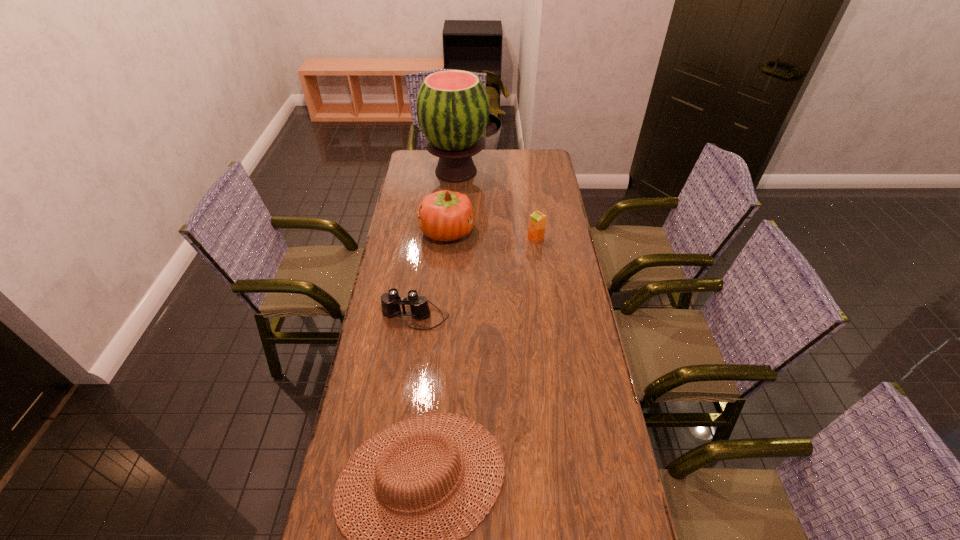
Where is `watermelon present at the left edge`? This screenshot has width=960, height=540. watermelon present at the left edge is located at coordinates point(452,106).

The image size is (960, 540). Find the location of `pumpkin at the left edge`. pumpkin at the left edge is located at coordinates (444, 215).

I want to click on binoculars present at the left edge, so click(390, 302).

Locate an element on the screen. This screenshot has width=960, height=540. object located in the right edge section of the desktop is located at coordinates (537, 223).

In order to click on object that is at the far left corner in this screenshot , I will do `click(452, 106)`.

Where is `vacant space at the far edge of the desktop`? The image size is (960, 540). vacant space at the far edge of the desktop is located at coordinates (486, 156).

In the image, there is a desktop. Where is `vacant space at the left edge`? Image resolution: width=960 pixels, height=540 pixels. vacant space at the left edge is located at coordinates (394, 266).

I want to click on vacant space at the right edge, so click(x=558, y=245).

Where is `free space at the far left corner of the desktop`? free space at the far left corner of the desktop is located at coordinates (421, 150).

Image resolution: width=960 pixels, height=540 pixels. In the image, there is a desktop. Find the location of `vacant space at the far right corner`. vacant space at the far right corner is located at coordinates (526, 150).